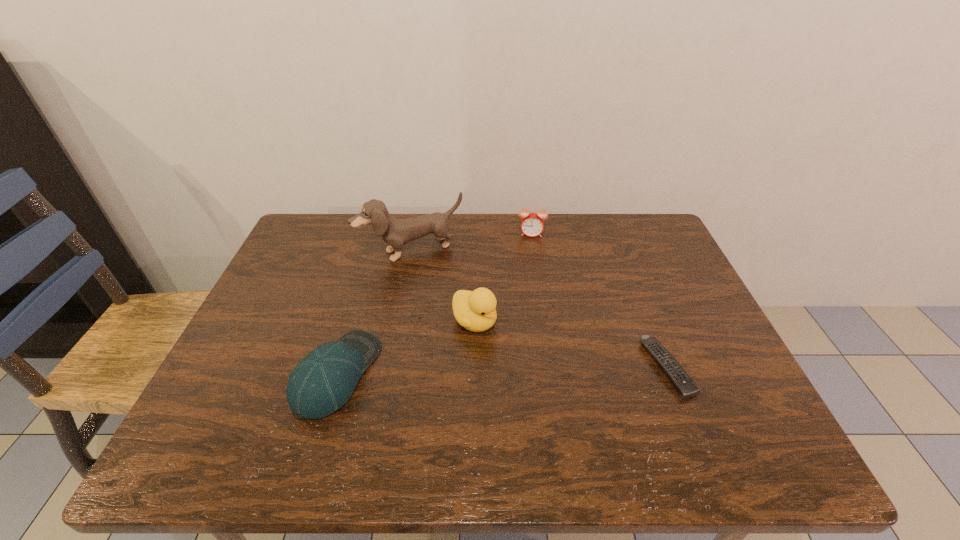
Locate an element on the screen. free space on the desktop that is between the fourth tallest object and the shortest object and is positioned at the face of the puppy is located at coordinates (470, 371).

Locate an element on the screen. free space on the desktop that is between the fourth tallest object and the shortest object and is positioned on the front-facing side of the duck is located at coordinates (543, 370).

Locate an element on the screen. The height and width of the screenshot is (540, 960). vacant space on the desktop that is between the baseball cap and the remote control and is positioned on the clock face of the alarm clock is located at coordinates (525, 370).